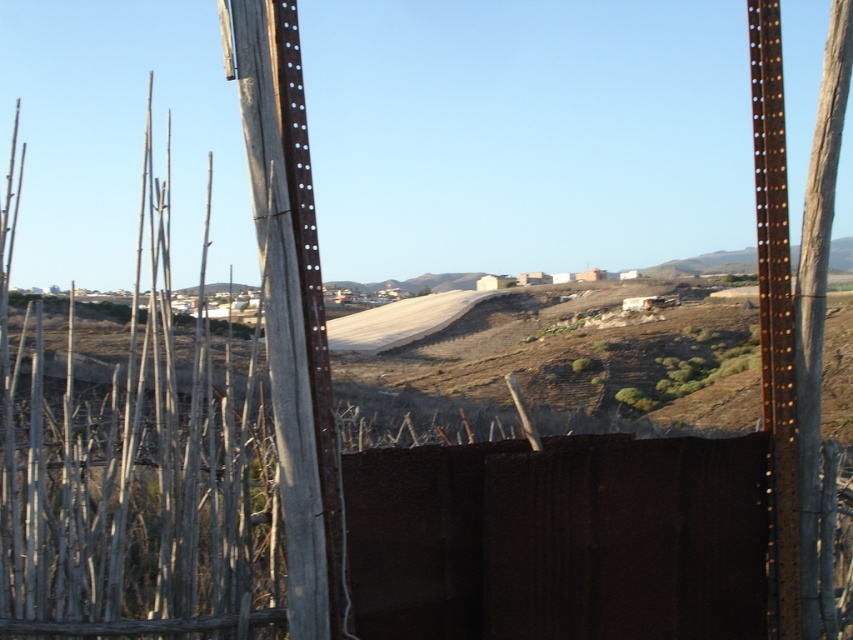
Question: Which of the following is the closest to the observer?

Choices:
 (A) rusty metal fence at center
 (B) rusty metal pole at center

Answer: (B)

Question: Can you confirm if rusty metal fence at center is bigger than rusty metal pole at center?

Choices:
 (A) no
 (B) yes

Answer: (B)

Question: Is rusty metal pole at center below rusty metal pole at right?

Choices:
 (A) yes
 (B) no

Answer: (A)

Question: Which object is positioned farthest from the rusty metal pole at right?

Choices:
 (A) rusty metal fence at center
 (B) rusty metal pole at center

Answer: (B)

Question: Which point is farther from the camera taking this photo?

Choices:
 (A) click(x=329, y=504)
 (B) click(x=434, y=486)
 (C) click(x=762, y=214)

Answer: (C)

Question: Does rusty metal pole at center appear on the left side of rusty metal pole at right?

Choices:
 (A) no
 (B) yes

Answer: (B)